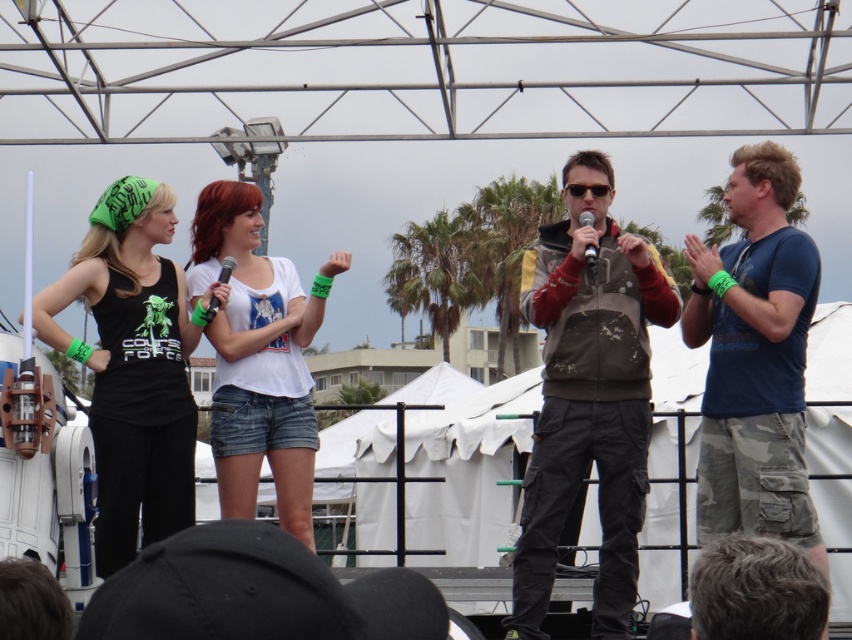
Is distressed brown jacket at center to the right of blue cotton shirt at center from the viewer's perspective?

Incorrect, distressed brown jacket at center is not on the right side of blue cotton shirt at center.

In the scene shown: Can you confirm if distressed brown jacket at center is taller than blue cotton shirt at center?

Correct, distressed brown jacket at center is much taller as blue cotton shirt at center.

Is point (547, 486) in front of point (766, 294)?

Yes, it is in front of point (766, 294).

Locate an element on the screen. This screenshot has height=640, width=852. distressed brown jacket at center is located at coordinates tap(588, 396).

From the picture: Who is positioned more to the left, matte black tank top at left or silver metallic microphone at center?

matte black tank top at left

Looking at this image, is matte black tank top at left below silver metallic microphone at center?

Correct, matte black tank top at left is located below silver metallic microphone at center.

Is point (135, 396) positioned in front of point (590, 257)?

No, (135, 396) is further to viewer.

At what (x,y) coordinates should I click in order to perform the action: click on matte black tank top at left. Please return your answer as a coordinate pair (x, y). The width and height of the screenshot is (852, 640). Looking at the image, I should click on (131, 365).

Can you confirm if blue cotton shirt at center is thinner than silver metallic microphone at center?

In fact, blue cotton shirt at center might be wider than silver metallic microphone at center.

Is point (715, 445) farther from viewer compared to point (590, 214)?

No, it is in front of (590, 214).

The width and height of the screenshot is (852, 640). In order to click on blue cotton shirt at center in this screenshot , I will do `click(755, 356)`.